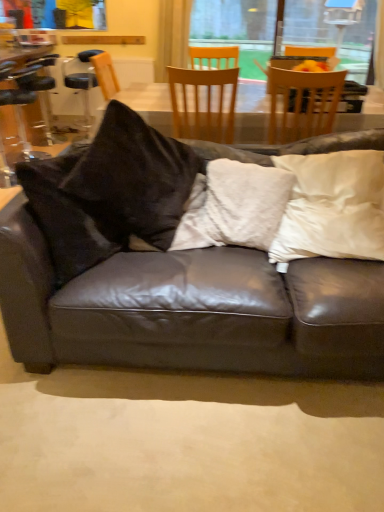
Question: Can you confirm if wooden chair at upper center, the first chair positioned from the right, is thinner than white fuzzy pillow at center, which is the first pillow in left-to-right order?

Choices:
 (A) yes
 (B) no

Answer: (B)

Question: Is wooden chair at upper center, the first chair positioned from the right, smaller than white fuzzy pillow at center, which appears as the second pillow when viewed from the right?

Choices:
 (A) no
 (B) yes

Answer: (A)

Question: Is wooden chair at upper center, the 3th chair positioned from the left, far from white fuzzy pillow at center, which appears as the second pillow when viewed from the right?

Choices:
 (A) yes
 (B) no

Answer: (A)

Question: Could you tell me if wooden chair at upper center, the 3th chair positioned from the left, is facing white fuzzy pillow at center, which appears as the second pillow when viewed from the right?

Choices:
 (A) no
 (B) yes

Answer: (A)

Question: Does wooden chair at upper center, the first chair positioned from the right, appear on the left side of white fuzzy pillow at center, which appears as the second pillow when viewed from the right?

Choices:
 (A) no
 (B) yes

Answer: (A)

Question: Can you confirm if wooden chair at upper center, the 3th chair positioned from the left, is wider than white fuzzy pillow at center, which is the first pillow in left-to-right order?

Choices:
 (A) no
 (B) yes

Answer: (B)

Question: Is wooden chair at upper center, the first chair positioned from the right, to the left of white satin pillow at upper right, the 1th pillow in the right-to-left sequence, from the viewer's perspective?

Choices:
 (A) yes
 (B) no

Answer: (B)

Question: Is white satin pillow at upper right, the 2th pillow positioned from the left, a part of wooden chair at upper center, the first chair positioned from the right?

Choices:
 (A) yes
 (B) no

Answer: (B)

Question: Is wooden chair at upper center, the first chair positioned from the right, beside white satin pillow at upper right, the 1th pillow in the right-to-left sequence?

Choices:
 (A) no
 (B) yes

Answer: (A)

Question: Considering the relative sizes of wooden chair at upper center, the first chair positioned from the right, and white satin pillow at upper right, the 1th pillow in the right-to-left sequence, in the image provided, is wooden chair at upper center, the first chair positioned from the right, taller than white satin pillow at upper right, the 1th pillow in the right-to-left sequence,?

Choices:
 (A) yes
 (B) no

Answer: (A)

Question: Is wooden chair at upper center, the first chair positioned from the right, positioned far away from white satin pillow at upper right, the 1th pillow in the right-to-left sequence?

Choices:
 (A) no
 (B) yes

Answer: (A)

Question: From the image's perspective, is wooden chair at upper center, the 3th chair positioned from the left, below white satin pillow at upper right, the 2th pillow positioned from the left?

Choices:
 (A) yes
 (B) no

Answer: (B)

Question: Is matte black leather couch at center facing away from clear plastic bar stool at left?

Choices:
 (A) yes
 (B) no

Answer: (A)